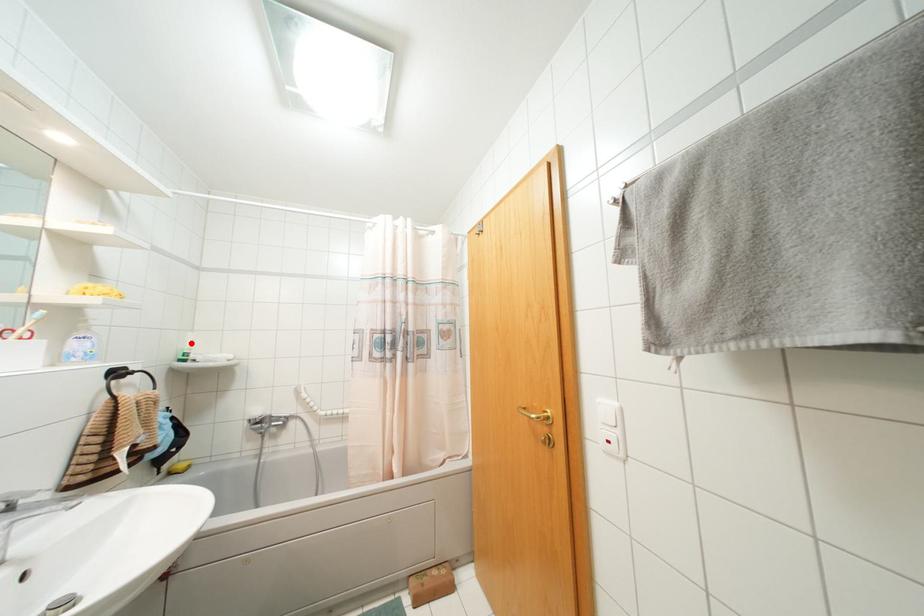
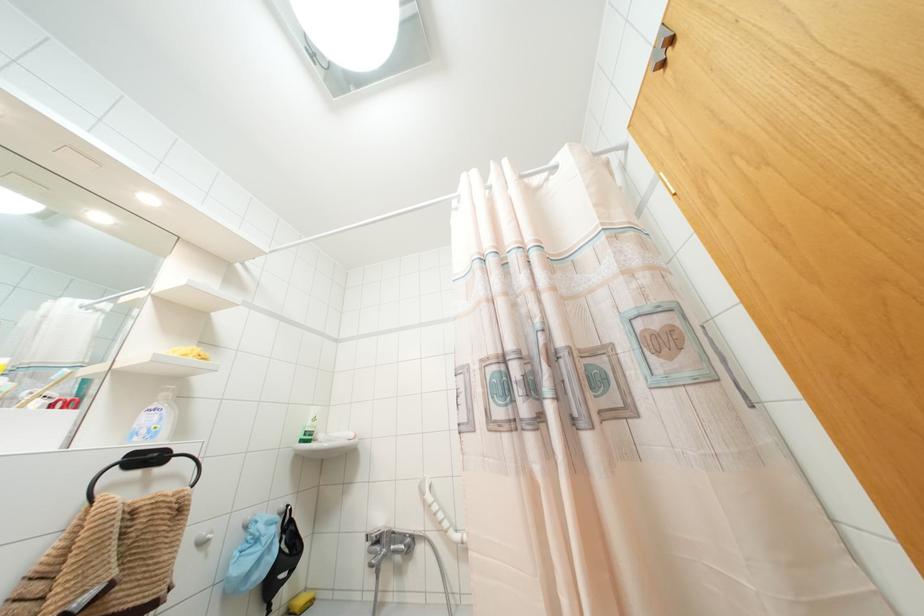
Where in the second image is the point corresponding to the highlighted location from the first image?

(312, 419)